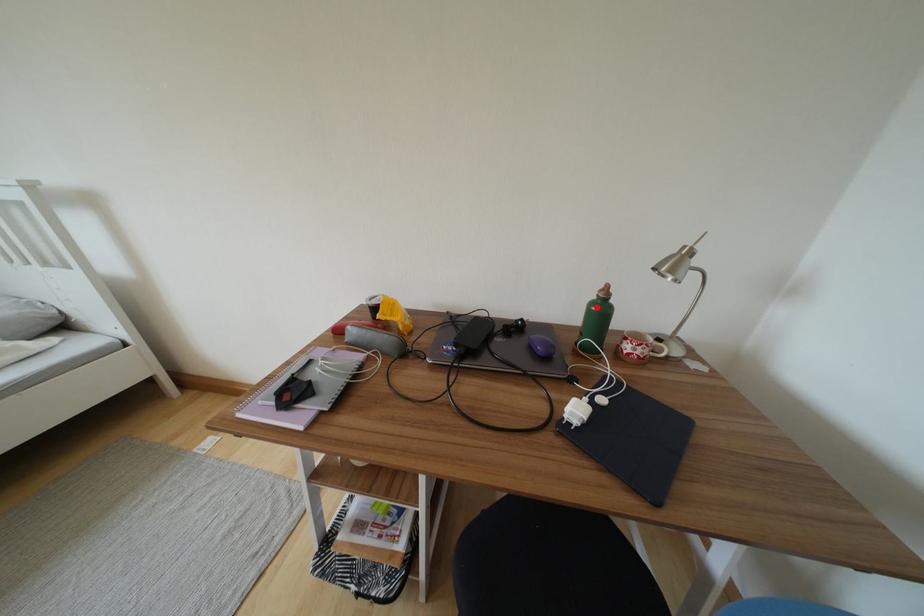
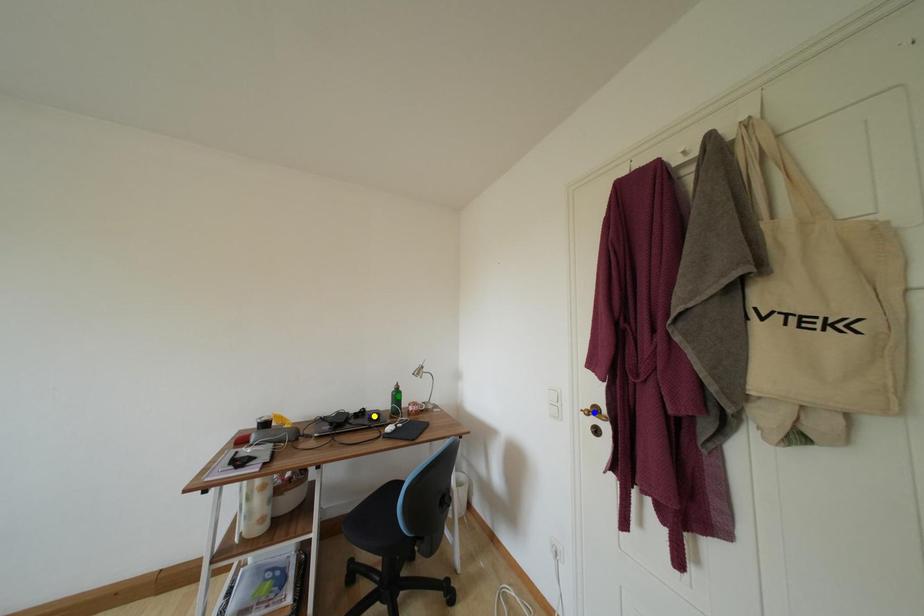
Question: I am providing you with two images of the same scene from different viewpoints. A red point is marked on the first image. You are given multiple points on the second image. Which spot in image 2 lines up with the point in image 1?

Choices:
 (A) green point
 (B) yellow point
 (C) blue point

Answer: (A)